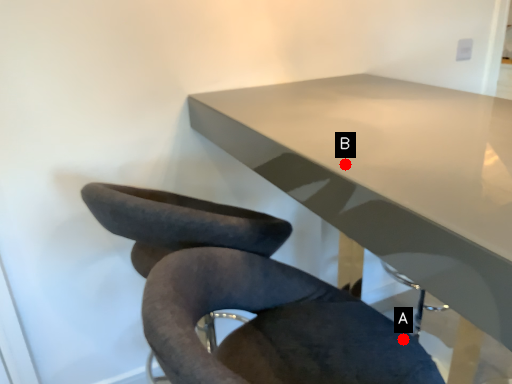
Question: Two points are circled on the image, labeled by A and B beside each circle. Which point is closer to the camera?

Choices:
 (A) A is closer
 (B) B is closer

Answer: (B)